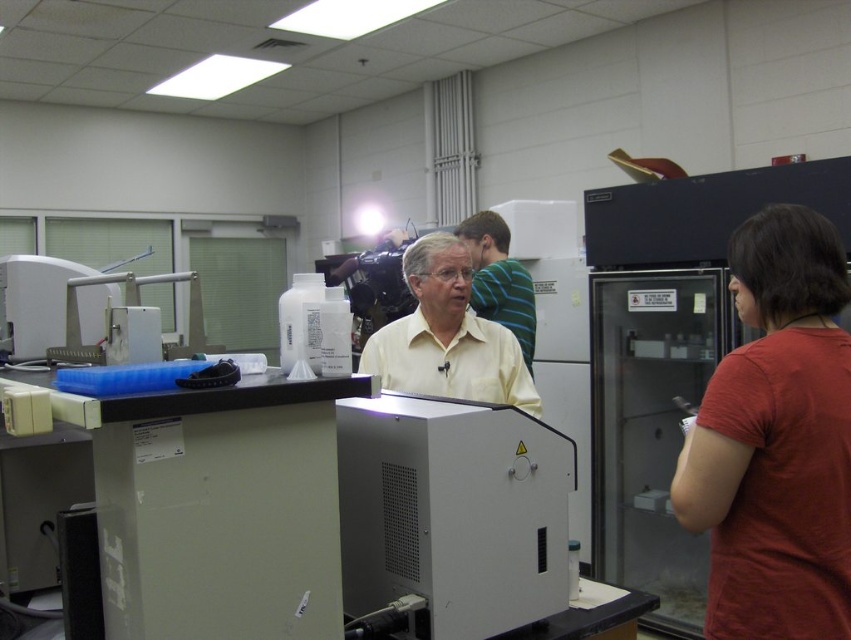
Question: Which point is closer to the camera?

Choices:
 (A) light yellow shirt at center
 (B) red cotton shirt at right

Answer: (B)

Question: Is red cotton shirt at right smaller than white plastic machine at center?

Choices:
 (A) yes
 (B) no

Answer: (A)

Question: Observing the image, what is the correct spatial positioning of red cotton shirt at right in reference to yellow matte shirt at center?

Choices:
 (A) below
 (B) above

Answer: (A)

Question: Is red cotton shirt at right thinner than light yellow shirt at center?

Choices:
 (A) yes
 (B) no

Answer: (A)

Question: Which object is farther from the camera taking this photo?

Choices:
 (A) yellow matte shirt at center
 (B) white plastic machine at center

Answer: (A)

Question: Based on their relative distances, which object is farther from the red cotton shirt at right?

Choices:
 (A) yellow matte shirt at center
 (B) white plastic machine at center
 (C) light yellow shirt at center

Answer: (C)